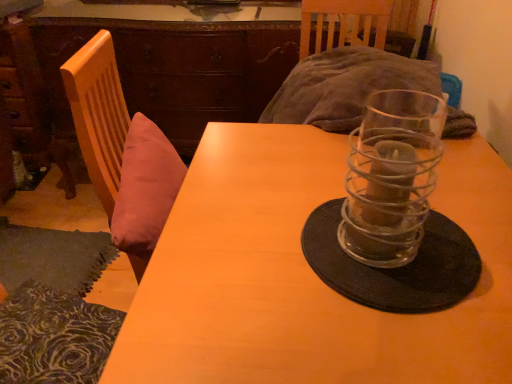
Question: Is black matte glass plate at center smaller than clear glass candle holder at center?

Choices:
 (A) yes
 (B) no

Answer: (A)

Question: Is black matte glass plate at center further to camera compared to clear glass candle holder at center?

Choices:
 (A) yes
 (B) no

Answer: (A)

Question: Does black matte glass plate at center have a lesser width compared to clear glass candle holder at center?

Choices:
 (A) no
 (B) yes

Answer: (A)

Question: Can you confirm if black matte glass plate at center is positioned to the right of clear glass candle holder at center?

Choices:
 (A) no
 (B) yes

Answer: (B)

Question: Is there a large distance between black matte glass plate at center and clear glass candle holder at center?

Choices:
 (A) no
 (B) yes

Answer: (A)

Question: Is black matte glass plate at center in front of or behind brown wood dresser at upper left in the image?

Choices:
 (A) front
 (B) behind

Answer: (A)

Question: In the image, is black matte glass plate at center on the left side or the right side of brown wood dresser at upper left?

Choices:
 (A) left
 (B) right

Answer: (B)

Question: From the image's perspective, is black matte glass plate at center above or below brown wood dresser at upper left?

Choices:
 (A) above
 (B) below

Answer: (B)

Question: Is black matte glass plate at center taller or shorter than brown wood dresser at upper left?

Choices:
 (A) tall
 (B) short

Answer: (B)

Question: Is clear glass candle holder at center to the left or to the right of brown wood dresser at upper left in the image?

Choices:
 (A) left
 (B) right

Answer: (B)

Question: Considering the positions of clear glass candle holder at center and brown wood dresser at upper left in the image, is clear glass candle holder at center bigger or smaller than brown wood dresser at upper left?

Choices:
 (A) small
 (B) big

Answer: (A)

Question: Considering the positions of point (396, 152) and point (159, 19), is point (396, 152) closer or farther from the camera than point (159, 19)?

Choices:
 (A) closer
 (B) farther

Answer: (A)

Question: Relative to brown wood dresser at upper left, is clear glass candle holder at center in front or behind?

Choices:
 (A) front
 (B) behind

Answer: (A)

Question: Would you say wooden table at center is inside or outside brown wood dresser at upper left?

Choices:
 (A) outside
 (B) inside

Answer: (A)

Question: Considering the positions of wooden table at center and brown wood dresser at upper left in the image, is wooden table at center taller or shorter than brown wood dresser at upper left?

Choices:
 (A) short
 (B) tall

Answer: (B)